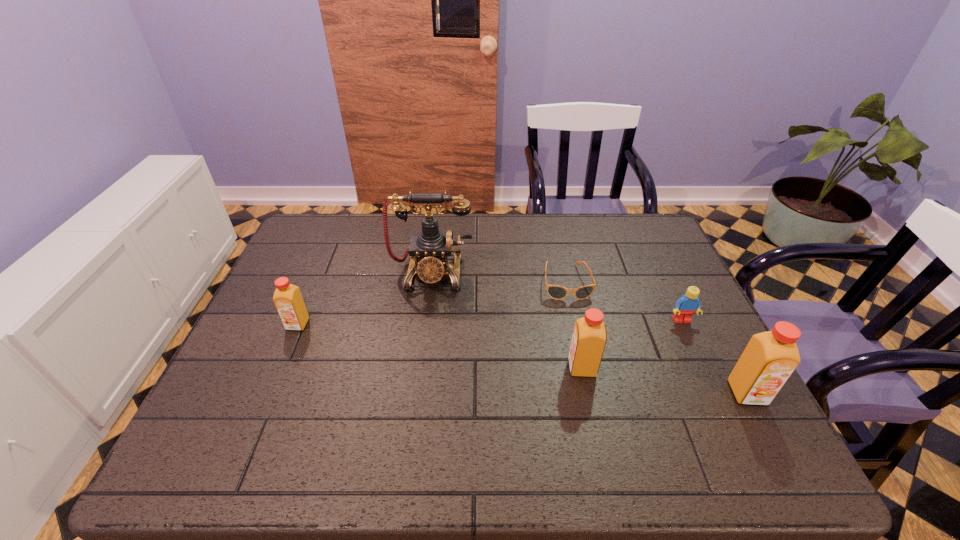
Locate which orange juice ranks second in proximity to the third tallest object. Please provide its 2D coordinates. Your answer should be formatted as a tuple, i.e. [(x, y)], where the tuple contains the x and y coordinates of a point satisfying the conditions above.

[(287, 298)]

Locate an element on the screen. This screenshot has width=960, height=540. orange juice that stands as the closest to the Lego is located at coordinates (769, 359).

Where is `vacant region that satisfies the following two spatial constraints: 1. on the front-facing side of the sunglasses; 2. on the front and back of the second farthest orange juice`? vacant region that satisfies the following two spatial constraints: 1. on the front-facing side of the sunglasses; 2. on the front and back of the second farthest orange juice is located at coordinates (585, 368).